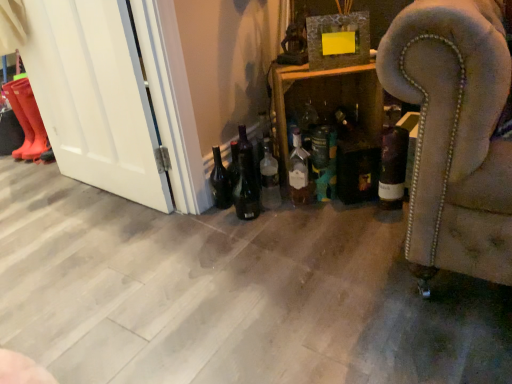
Image resolution: width=512 pixels, height=384 pixels. I want to click on free space on the front side of black glass beer bottle at lower center, which ranks as the second beer bottle in left-to-right order, so click(x=251, y=237).